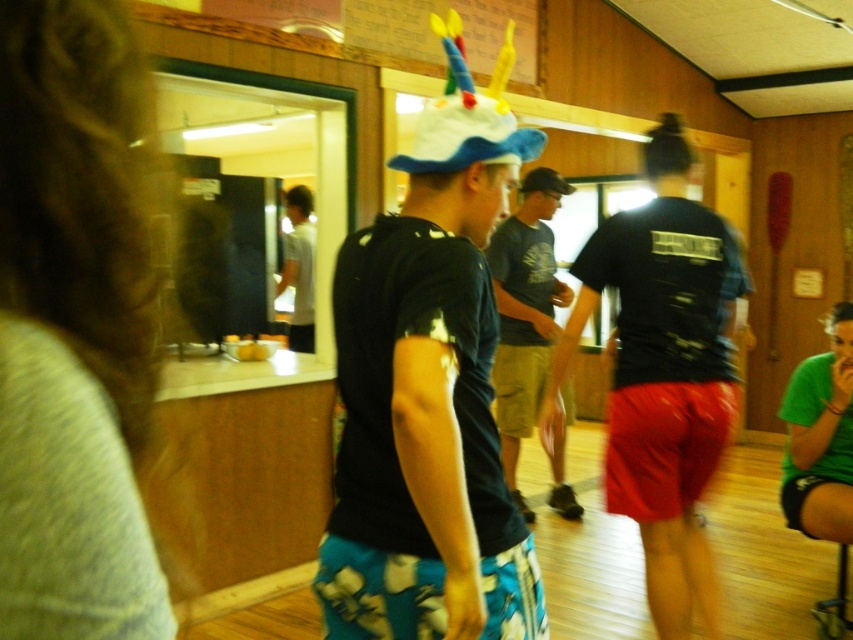
Who is positioned more to the right, dark blue t-shirt at center or green fabric shorts at lower right?

green fabric shorts at lower right

Can you confirm if dark blue t-shirt at center is positioned above green fabric shorts at lower right?

Correct, dark blue t-shirt at center is located above green fabric shorts at lower right.

Who is more distant from viewer, (532, 140) or (807, 436)?

The point (807, 436) is behind.

Image resolution: width=853 pixels, height=640 pixels. Find the location of `dark blue t-shirt at center`. dark blue t-shirt at center is located at coordinates (428, 392).

Does dark blue t-shirt at center appear over black fabric baseball cap at center?

No, dark blue t-shirt at center is not above black fabric baseball cap at center.

Is dark blue t-shirt at center below black fabric baseball cap at center?

Indeed, dark blue t-shirt at center is positioned under black fabric baseball cap at center.

Who is more distant from viewer, (538, 611) or (550, 189)?

The point (550, 189) is more distant.

You are a GUI agent. You are given a task and a screenshot of the screen. Output one action in this format:
    pyautogui.click(x=<x>, y=<y>)
    Task: Click on the dark blue t-shirt at center
    
    Given the screenshot: What is the action you would take?
    pyautogui.click(x=428, y=392)

Based on the photo, is dark blue t-shirt at center smaller than dark gray t-shirt at center?

Yes.

Is point (509, 556) closer to camera compared to point (512, 492)?

Yes, it is in front of point (512, 492).

Locate an element on the screen. The width and height of the screenshot is (853, 640). dark blue t-shirt at center is located at coordinates coord(428,392).